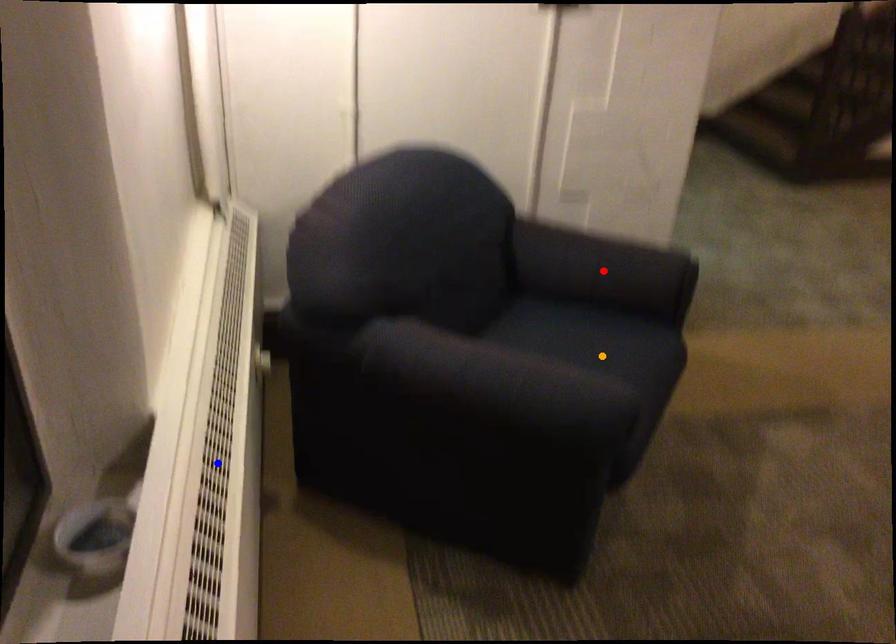
Order these from nearest to farthest:
- blue point
- orange point
- red point

1. blue point
2. orange point
3. red point